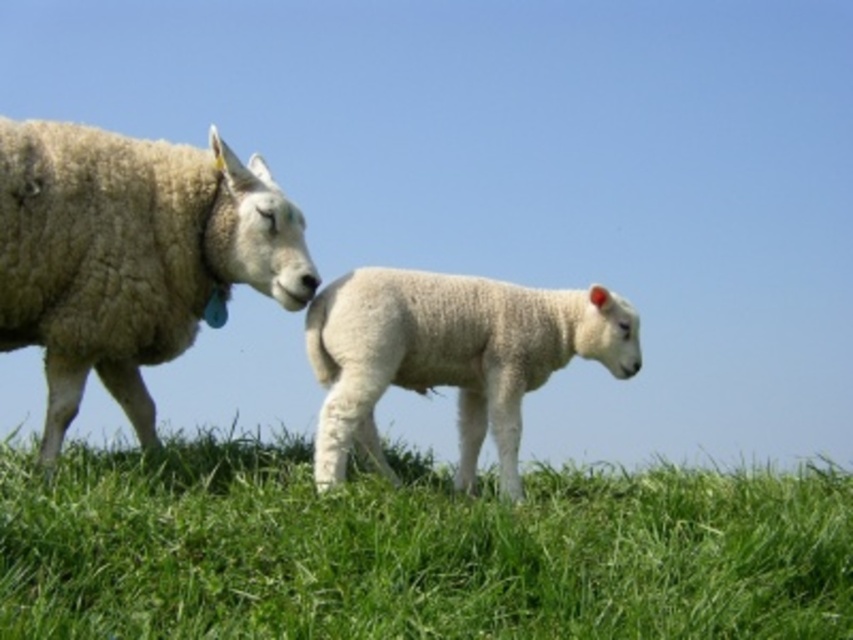
Question: Which of these objects is positioned closest to the green grassy at lower center?

Choices:
 (A) white woolen lamb at center
 (B) white woolen sheep at left

Answer: (A)

Question: Which point appears closest to the camera in this image?

Choices:
 (A) (51, 396)
 (B) (328, 448)

Answer: (B)

Question: Can you confirm if green grassy at lower center is thinner than white woolen sheep at left?

Choices:
 (A) yes
 (B) no

Answer: (B)

Question: Can you confirm if green grassy at lower center is thinner than white woolen sheep at left?

Choices:
 (A) yes
 (B) no

Answer: (B)

Question: Can you confirm if green grassy at lower center is thinner than white woolen lamb at center?

Choices:
 (A) yes
 (B) no

Answer: (B)

Question: Which point is closer to the camera?

Choices:
 (A) (801, 600)
 (B) (299, 228)
 (C) (466, 486)

Answer: (A)